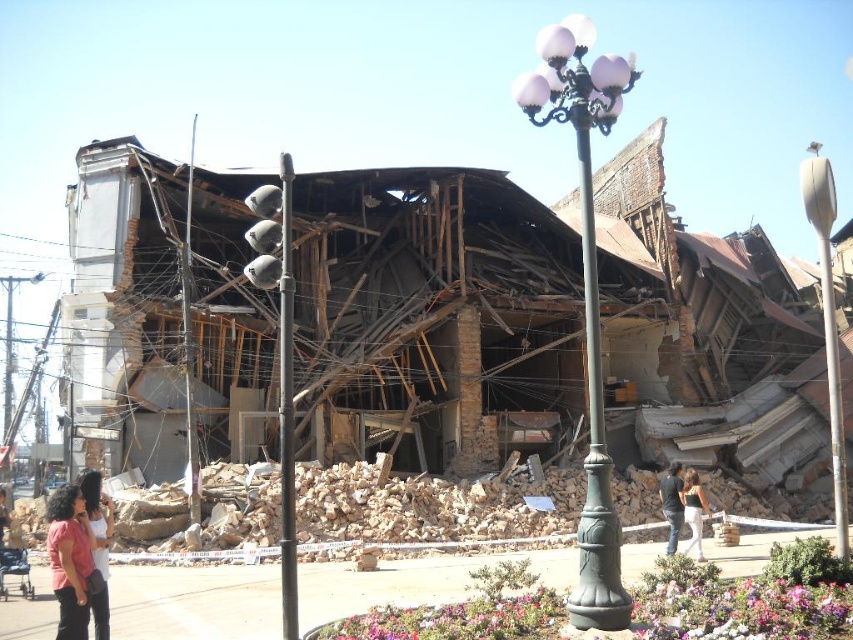
Question: Among these objects, which one is nearest to the camera?

Choices:
 (A) dark blue jeans at center
 (B) white cotton pants at lower right
 (C) green cast iron streetlight at center

Answer: (C)

Question: In this image, where is black metal traffic light at center located relative to white cotton pants at lower right?

Choices:
 (A) above
 (B) below

Answer: (A)

Question: Which object is positioned farthest from the metallic gray pole at right?

Choices:
 (A) green metal pole at center
 (B) metallic gray pole at center
 (C) pink fabric shirt at lower left
 (D) green cast iron streetlight at center

Answer: (B)

Question: Considering the real-world distances, which object is closest to the white cotton pants at lower right?

Choices:
 (A) matte pink shirt at lower left
 (B) dark blue jeans at center

Answer: (B)

Question: Is metallic pole at right further to the viewer compared to pink fabric shirt at lower left?

Choices:
 (A) yes
 (B) no

Answer: (A)

Question: Is metallic pole at right smaller than pink fabric shirt at lower left?

Choices:
 (A) yes
 (B) no

Answer: (B)